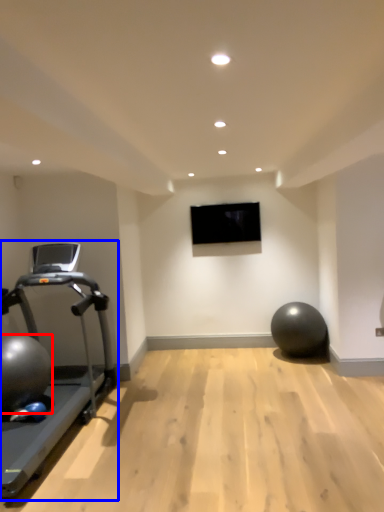
Question: Which object is further to the camera taking this photo, ball (highlighted by a red box) or treadmill (highlighted by a blue box)?

Choices:
 (A) ball
 (B) treadmill

Answer: (A)